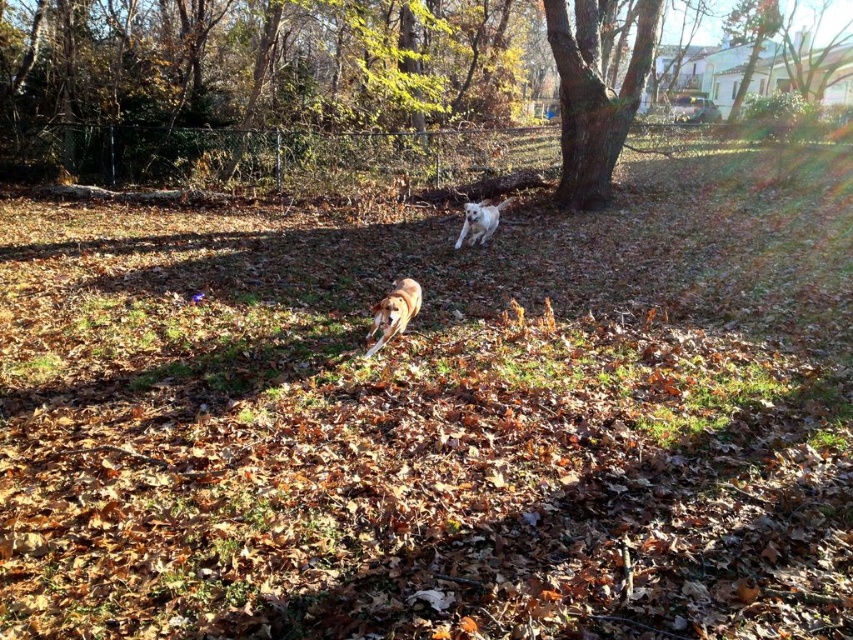
Is brown rough bark tree at upper center above white fluffy dog at center?

Yes, brown rough bark tree at upper center is above white fluffy dog at center.

Is brown rough bark tree at upper center to the right of white fluffy dog at center from the viewer's perspective?

Yes, brown rough bark tree at upper center is to the right of white fluffy dog at center.

Does point (593, 65) come in front of point (466, 204)?

That is True.

You are a GUI agent. You are given a task and a screenshot of the screen. Output one action in this format:
    pyautogui.click(x=<x>, y=<y>)
    Task: Click on the brown rough bark tree at upper center
    
    Given the screenshot: What is the action you would take?
    pyautogui.click(x=595, y=96)

Between brown rough bark tree at upper center and brown furry dog at center, which one is positioned lower?

brown furry dog at center

Describe the element at coordinates (595, 96) in the screenshot. I see `brown rough bark tree at upper center` at that location.

Is point (612, 120) farther from camera compared to point (395, 333)?

Yes, it is.

This screenshot has width=853, height=640. Find the location of `brown rough bark tree at upper center`. brown rough bark tree at upper center is located at coordinates (595, 96).

From the picture: Is brown furry dog at center shorter than white fluffy dog at center?

Correct, brown furry dog at center is not as tall as white fluffy dog at center.

Is point (405, 323) positioned after point (459, 232)?

No, it is in front of (459, 232).

Locate an element on the screen. The image size is (853, 640). brown furry dog at center is located at coordinates (393, 310).